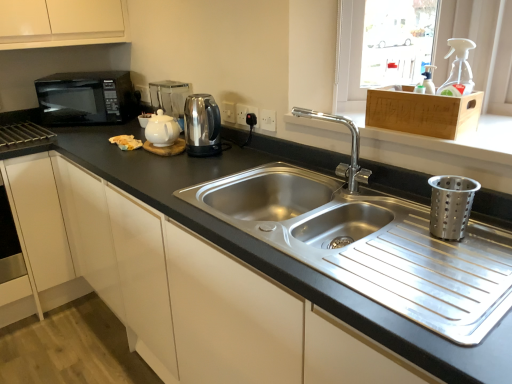
Find the location of a particular element. vacant area that lies between white glossy tea pot at center and stainless steel kettle at center is located at coordinates (182, 162).